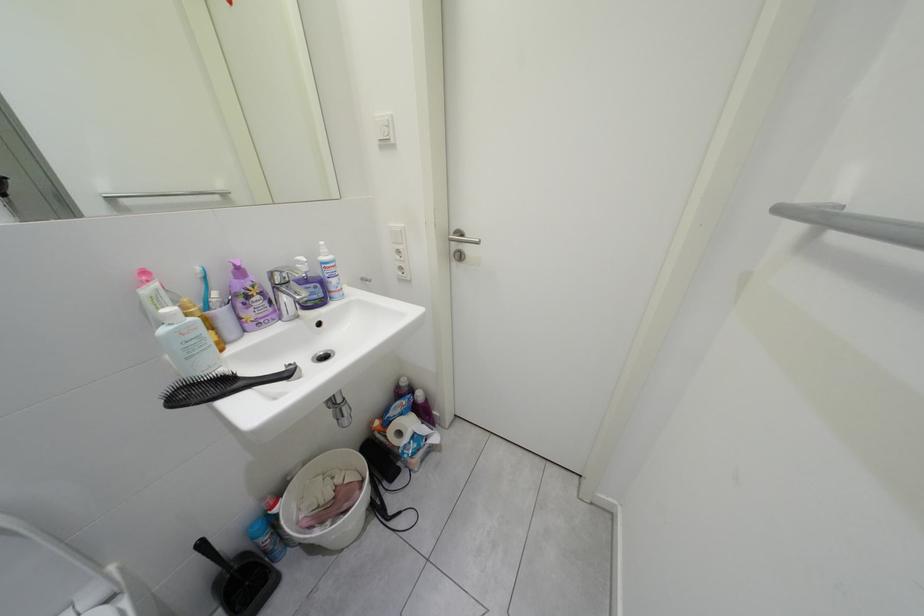
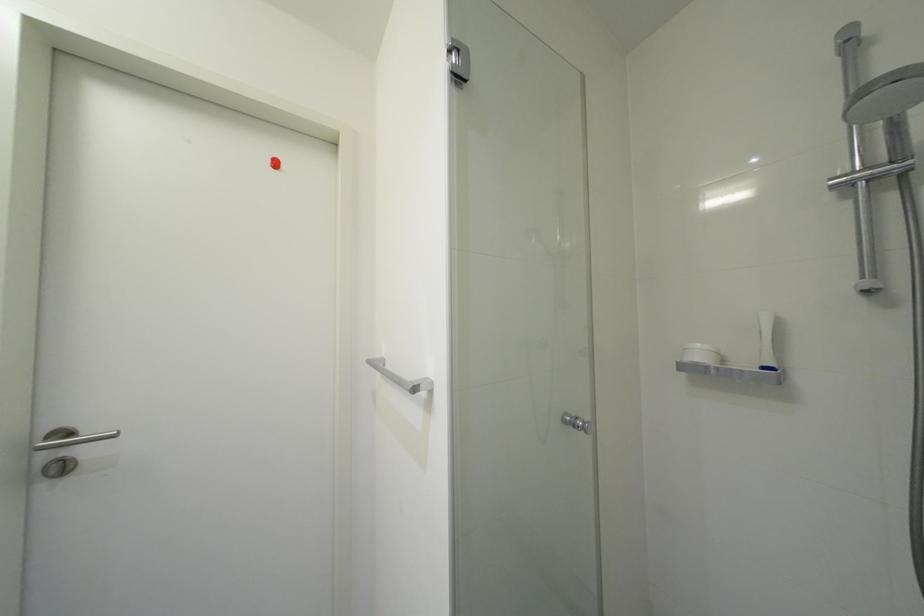
Question: The camera is either moving clockwise (left) or counter-clockwise (right) around the object. The first image is from the beginning of the video and the second image is from the end. Is the camera moving left or right when shooting the video?

Choices:
 (A) Left
 (B) Right

Answer: (A)